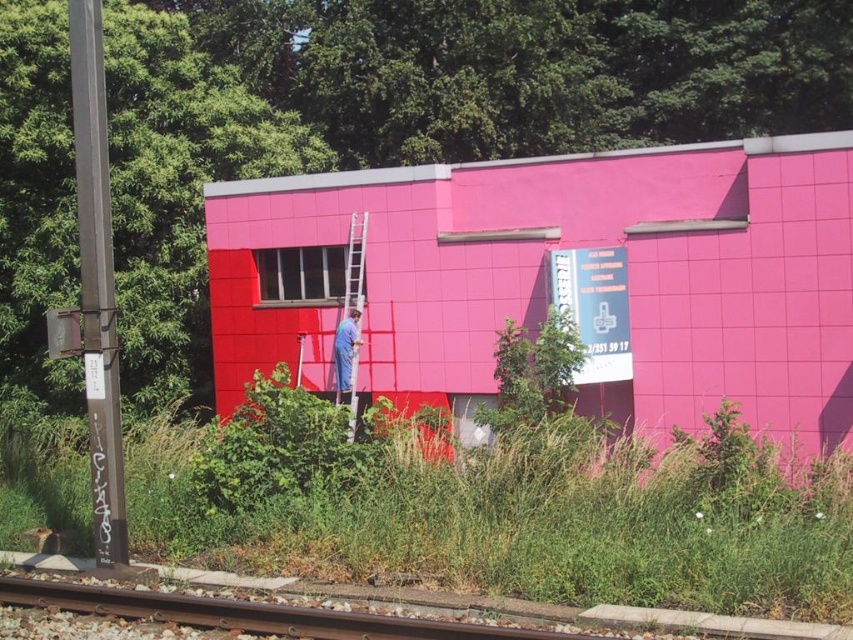
You are standing at the entrance of the building and want to reach the blue signboard attached to the wall near the top right corner. The metallic silver ladder at center is available. Based on its position, can you estimate if the ladder is placed appropriately to reach the signboard?

The metallic silver ladder at center is located at point (355, 266). Since the blue signboard is near the top right corner of the image, the ladder is positioned to the left of the signboard. Depending on the ladder height and the distance to the signboard, it might require moving the ladder closer to the wall and towards the right to reach the signboard effectively.